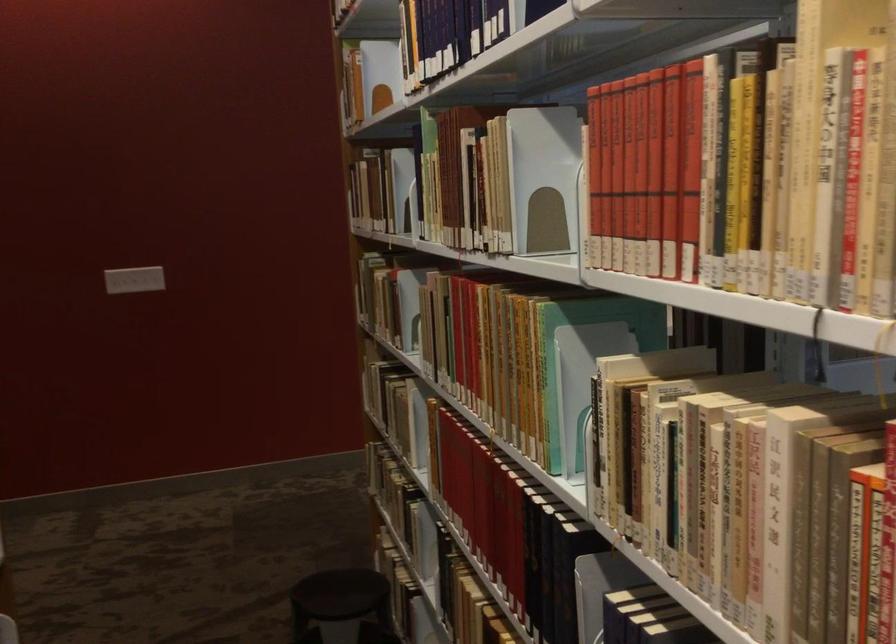
The image size is (896, 644). Describe the element at coordinates (340, 597) in the screenshot. I see `the stool sitting surface` at that location.